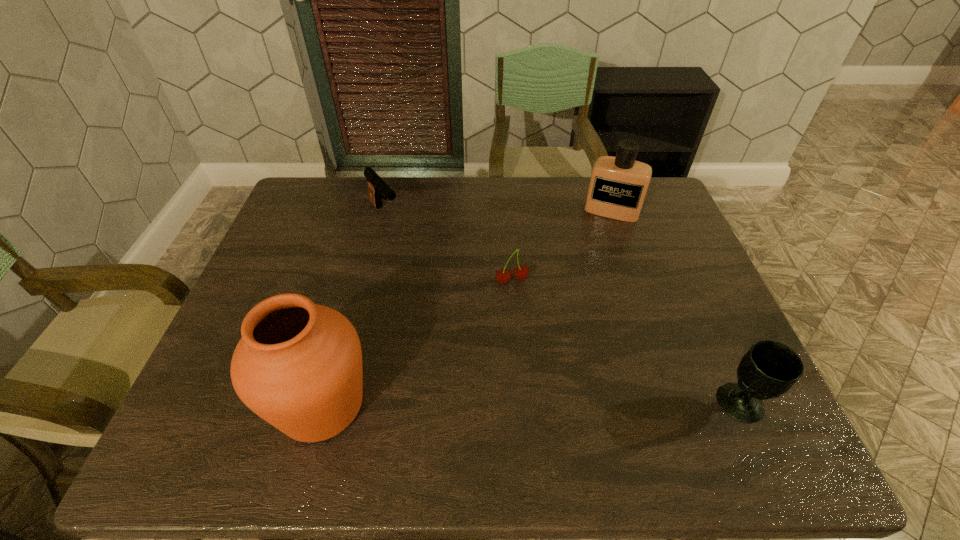
The height and width of the screenshot is (540, 960). What are the coordinates of `vacant space at the far left corner of the desktop` in the screenshot? It's located at (292, 219).

The height and width of the screenshot is (540, 960). In the image, there is a desktop. Identify the location of free space at the far right corner. (655, 186).

In the image, there is a desktop. At what (x,y) coordinates should I click in order to perform the action: click on vacant space at the near right corner. Please return your answer as a coordinate pair (x, y). The width and height of the screenshot is (960, 540). Looking at the image, I should click on (708, 409).

Identify the location of free space between the pistol and the shortest object. (448, 247).

Locate an element on the screen. free space between the tallest object and the perfume is located at coordinates (467, 308).

Find the location of `free space between the perfume and the second shortest object`. free space between the perfume and the second shortest object is located at coordinates (498, 212).

The image size is (960, 540). In order to click on vacant area that lies between the second shortest object and the second tallest object in this screenshot , I will do `click(498, 212)`.

Identify the location of free space between the third object from left to right and the pistol. This screenshot has height=540, width=960. (448, 247).

Locate an element on the screen. unoccupied position between the third shortest object and the cherry is located at coordinates (626, 342).

At what (x,y) coordinates should I click in order to perform the action: click on vacant area that lies between the cherry and the third shortest object. Please return your answer as a coordinate pair (x, y). Looking at the image, I should click on (626, 342).